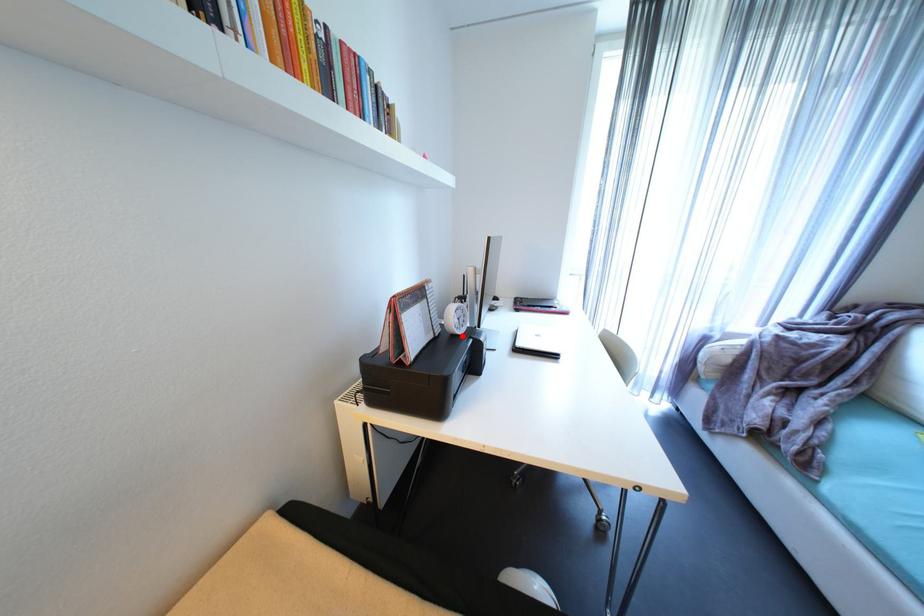
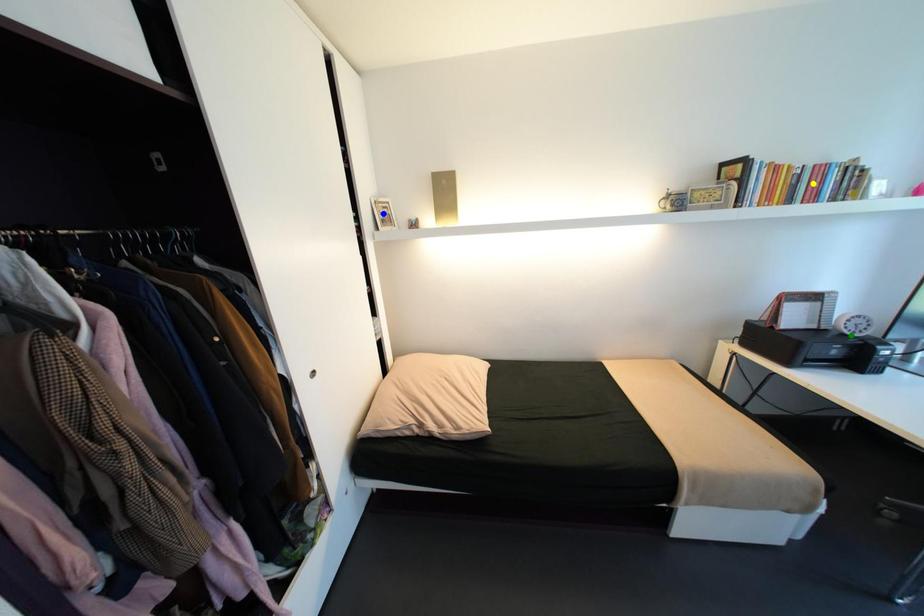
Question: I am providing you with two images of the same scene from different viewpoints. A red point is marked on the first image. You are given multiple points on the second image. Which point in image 2 is actually the same real-world point as the red point in image 1?

Choices:
 (A) blue point
 (B) green point
 (C) yellow point

Answer: (B)